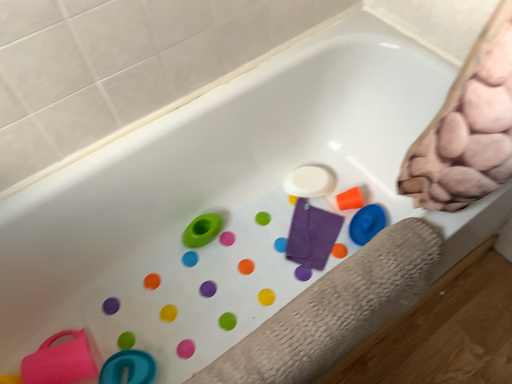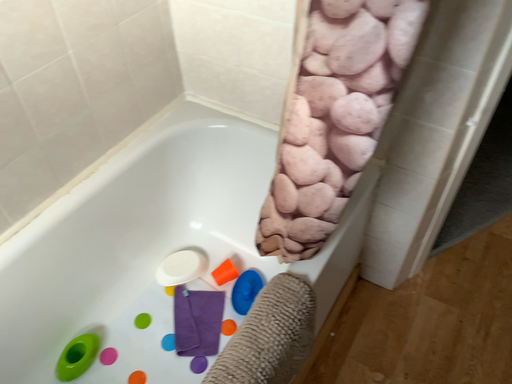
Question: How did the camera likely rotate when shooting the video?

Choices:
 (A) rotated upward
 (B) rotated downward

Answer: (A)